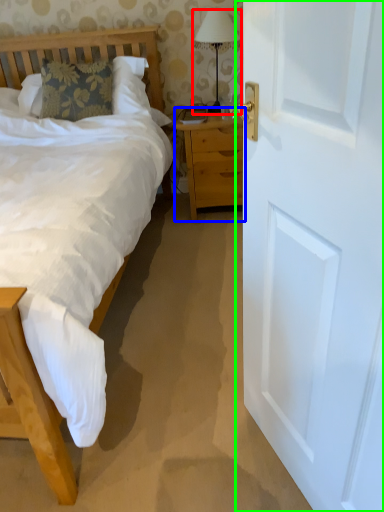
Question: Which object is positioned farthest from bedside lamp (highlighted by a red box)? Select from nightstand (highlighted by a blue box) and door (highlighted by a green box).

Choices:
 (A) nightstand
 (B) door

Answer: (B)